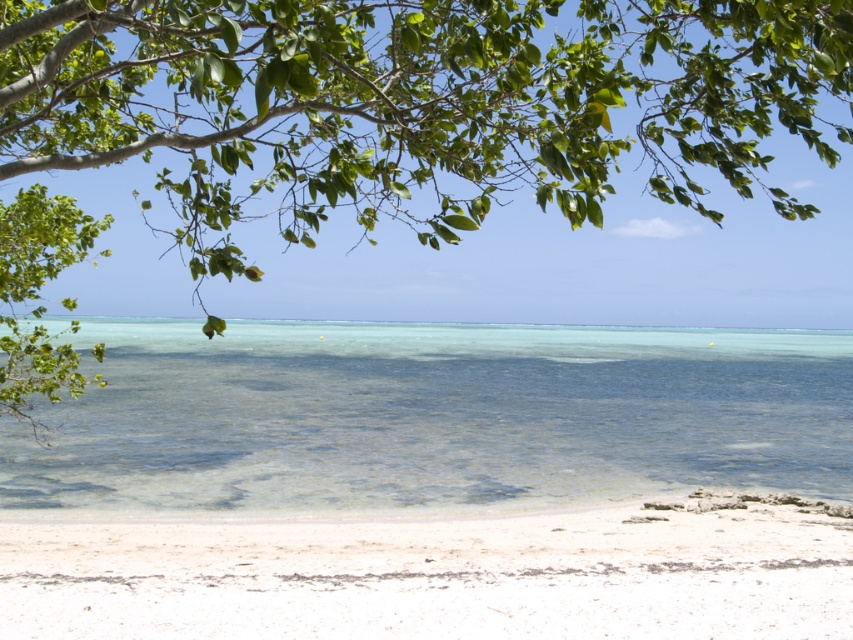
Question: Which object is positioned closest to the green leafy tree at upper left?

Choices:
 (A) white sandy beach at lower center
 (B) clear water at lower center

Answer: (B)

Question: Does green leafy tree at upper left come behind clear water at lower center?

Choices:
 (A) no
 (B) yes

Answer: (A)

Question: Among these objects, which one is farthest from the camera?

Choices:
 (A) white sandy beach at lower center
 (B) green leafy tree at upper left

Answer: (A)

Question: Does clear water at lower center have a lesser width compared to white sandy beach at lower center?

Choices:
 (A) no
 (B) yes

Answer: (A)

Question: Which point is farther to the camera?

Choices:
 (A) clear water at lower center
 (B) white sandy beach at lower center
 (C) green leafy tree at upper left

Answer: (A)

Question: Does clear water at lower center have a greater width compared to white sandy beach at lower center?

Choices:
 (A) yes
 (B) no

Answer: (A)